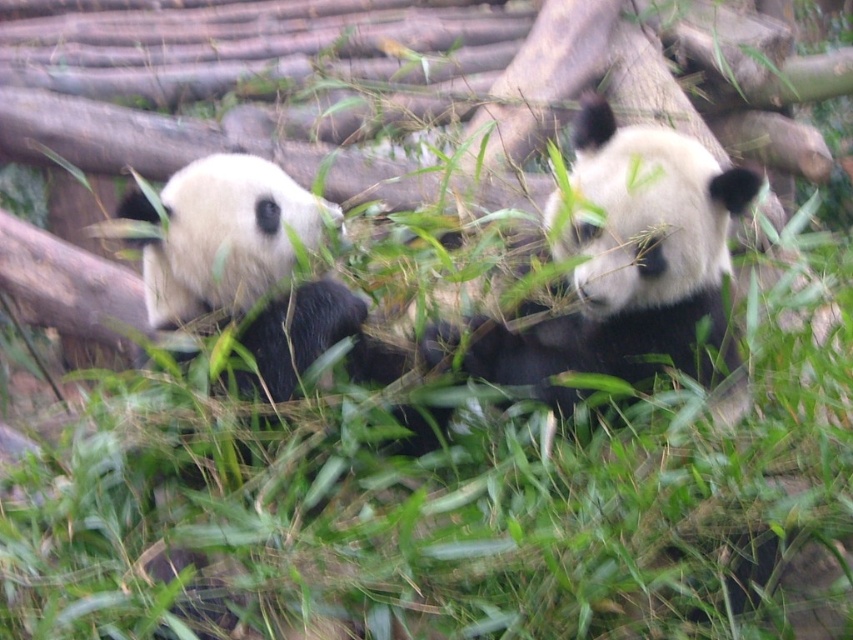
Question: Which of the following is the farthest from the observer?

Choices:
 (A) (335, 205)
 (B) (625, 275)

Answer: (A)

Question: Does black and white fur panda at center have a smaller size compared to white fur panda at left?

Choices:
 (A) no
 (B) yes

Answer: (B)

Question: Can you confirm if black and white fur panda at center is positioned to the right of white fur panda at left?

Choices:
 (A) yes
 (B) no

Answer: (A)

Question: Is black and white fur panda at center closer to the viewer compared to white fur panda at left?

Choices:
 (A) no
 (B) yes

Answer: (B)

Question: Which point is farther from the camera taking this photo?

Choices:
 (A) (675, 300)
 (B) (163, 278)

Answer: (B)